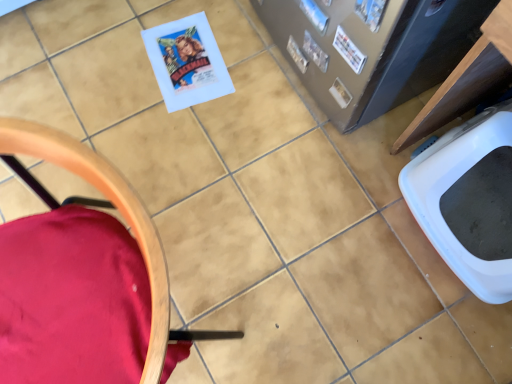
Question: From the image's perspective, is white paper comic book at upper right, which appears as the second comic book when viewed from the front, beneath blue glossy comic book at upper right, the 3th comic book viewed from the front?

Choices:
 (A) no
 (B) yes

Answer: (B)

Question: Considering the relative sizes of white paper comic book at upper right, which appears as the second comic book when viewed from the front, and blue glossy comic book at upper right, the 3th comic book viewed from the front, in the image provided, is white paper comic book at upper right, which appears as the second comic book when viewed from the front, wider than blue glossy comic book at upper right, the 3th comic book viewed from the front,?

Choices:
 (A) yes
 (B) no

Answer: (A)

Question: Is white paper comic book at upper right, the 2th comic book positioned from the back, taller than blue glossy comic book at upper right, positioned as the first comic book in back-to-front order?

Choices:
 (A) no
 (B) yes

Answer: (A)

Question: Can you see white paper comic book at upper right, which appears as the second comic book when viewed from the front, touching blue glossy comic book at upper right, positioned as the first comic book in back-to-front order?

Choices:
 (A) no
 (B) yes

Answer: (B)

Question: Is white paper comic book at upper right, which appears as the second comic book when viewed from the front, further to the viewer compared to blue glossy comic book at upper right, the 3th comic book viewed from the front?

Choices:
 (A) no
 (B) yes

Answer: (A)

Question: From the image's perspective, is velvet red chair at lower left positioned above or below blue glossy comic book at upper right, the 3th comic book viewed from the front?

Choices:
 (A) above
 (B) below

Answer: (B)

Question: In terms of width, does velvet red chair at lower left look wider or thinner when compared to blue glossy comic book at upper right, positioned as the first comic book in back-to-front order?

Choices:
 (A) wide
 (B) thin

Answer: (A)

Question: Considering the relative positions of velvet red chair at lower left and blue glossy comic book at upper right, positioned as the first comic book in back-to-front order, in the image provided, is velvet red chair at lower left to the left or to the right of blue glossy comic book at upper right, positioned as the first comic book in back-to-front order,?

Choices:
 (A) right
 (B) left

Answer: (B)

Question: From a real-world perspective, is velvet red chair at lower left physically located above or below blue glossy comic book at upper right, the 3th comic book viewed from the front?

Choices:
 (A) above
 (B) below

Answer: (A)

Question: From the image's perspective, is white paper comic book at upper right, which appears as the second comic book when viewed from the front, above or below blue glossy comic book at upper right, positioned as the first comic book in back-to-front order?

Choices:
 (A) above
 (B) below

Answer: (B)

Question: Is white paper comic book at upper right, which appears as the second comic book when viewed from the front, taller or shorter than blue glossy comic book at upper right, positioned as the first comic book in back-to-front order?

Choices:
 (A) short
 (B) tall

Answer: (A)

Question: From a real-world perspective, is white paper comic book at upper right, the 2th comic book positioned from the back, above or below blue glossy comic book at upper right, the 3th comic book viewed from the front?

Choices:
 (A) above
 (B) below

Answer: (A)

Question: In terms of size, does white paper comic book at upper right, the 2th comic book positioned from the back, appear bigger or smaller than blue glossy comic book at upper right, the 3th comic book viewed from the front?

Choices:
 (A) small
 (B) big

Answer: (A)

Question: Considering the positions of white plastic toilet bowl at lower right and matte paper comic book at upper right, the third comic book from the back, in the image, is white plastic toilet bowl at lower right taller or shorter than matte paper comic book at upper right, the third comic book from the back,?

Choices:
 (A) tall
 (B) short

Answer: (A)

Question: In terms of size, does white plastic toilet bowl at lower right appear bigger or smaller than matte paper comic book at upper right, acting as the 1th comic book starting from the front?

Choices:
 (A) small
 (B) big

Answer: (B)